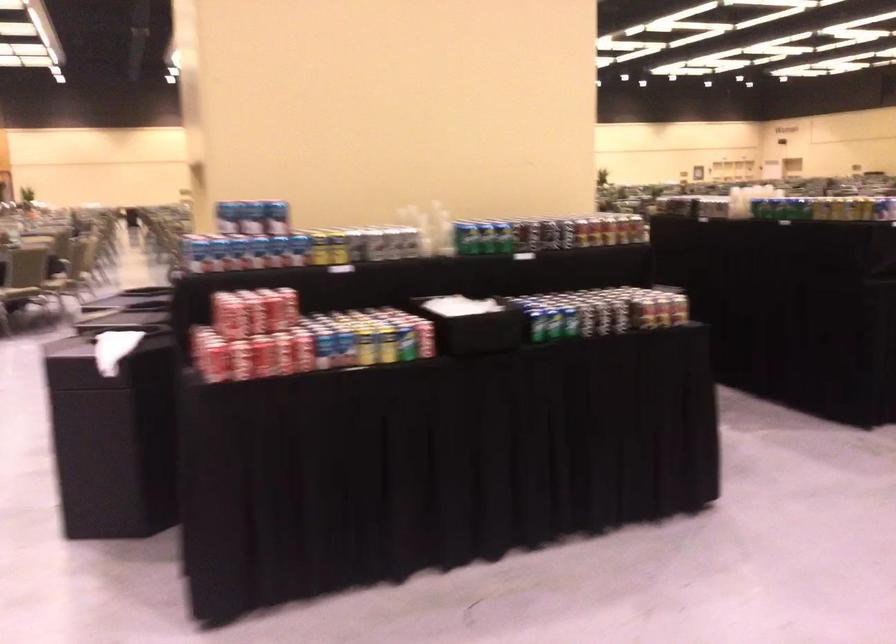
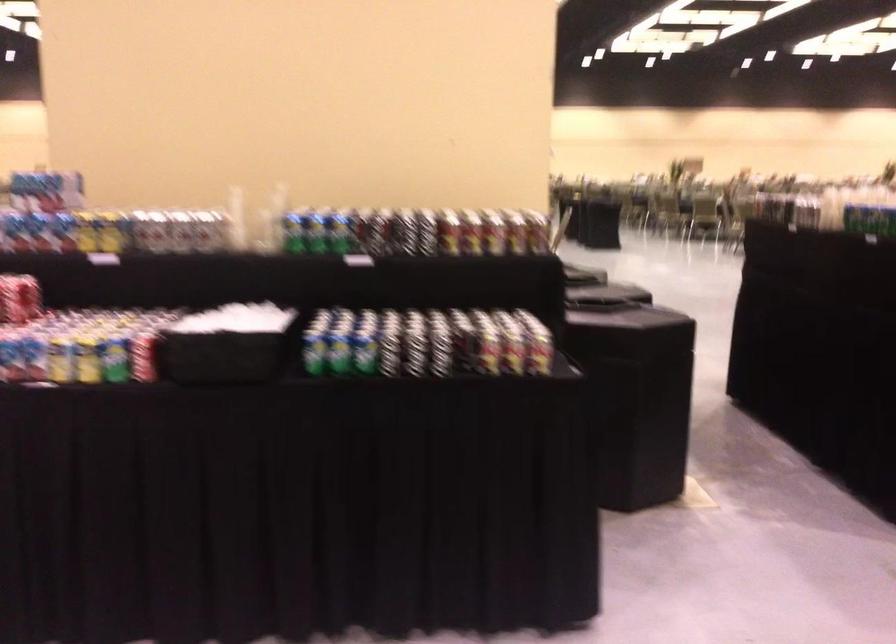
In a continuous first-person perspective shot, in which direction is the camera moving?

The cameraman walked toward right, forward.